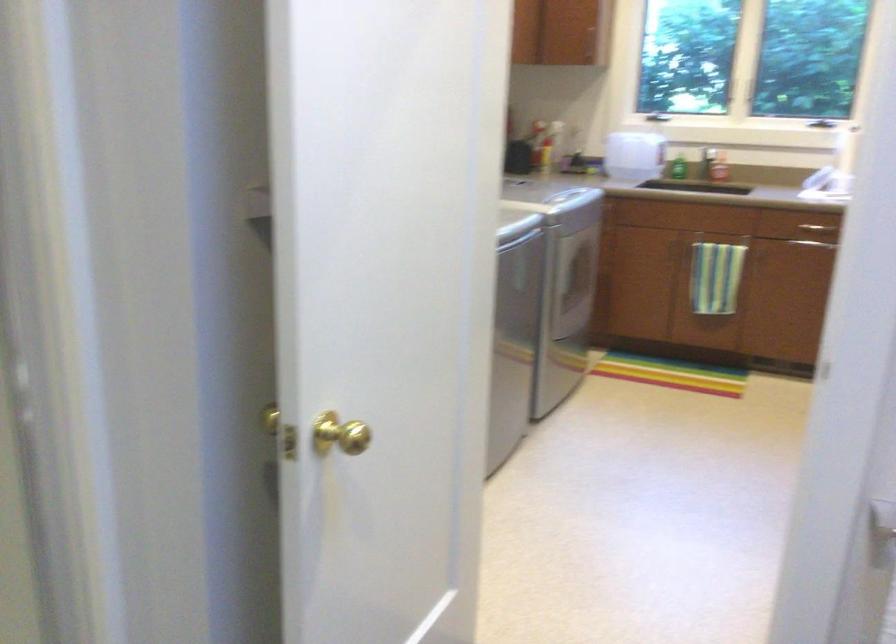
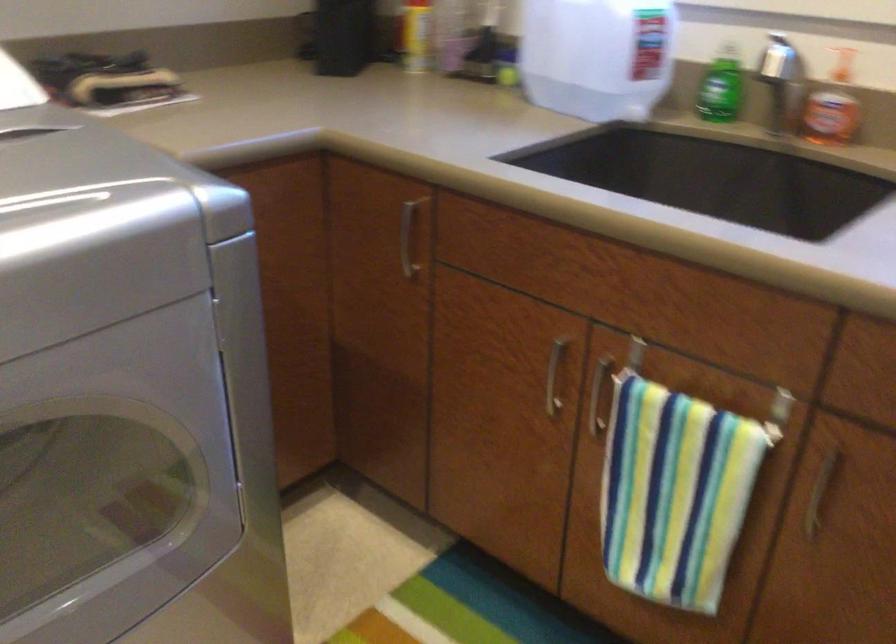
Find the pixel in the second image that matches (x=728, y=238) in the first image.

(727, 393)